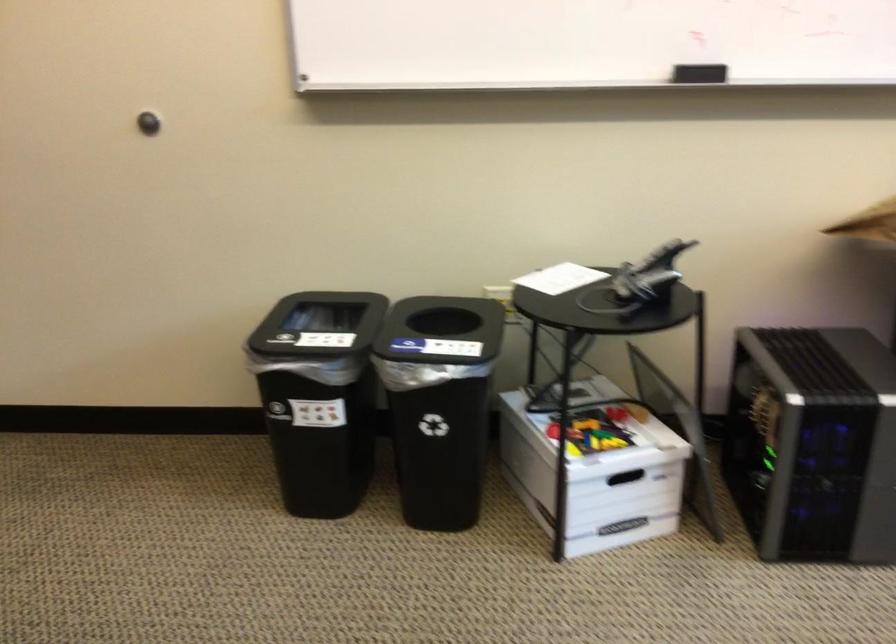
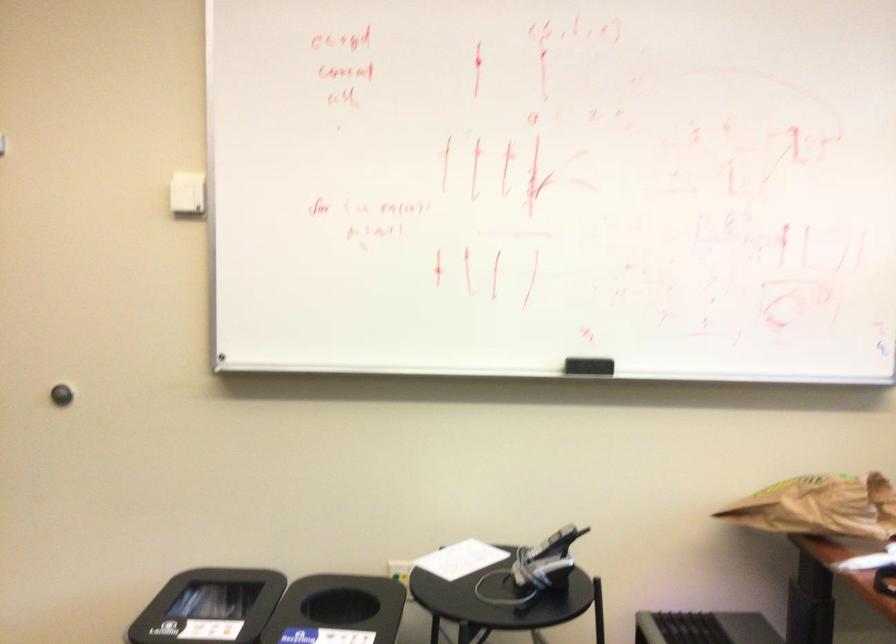
In the second image, find the point that corresponds to point 702,73 in the first image.

(588, 366)